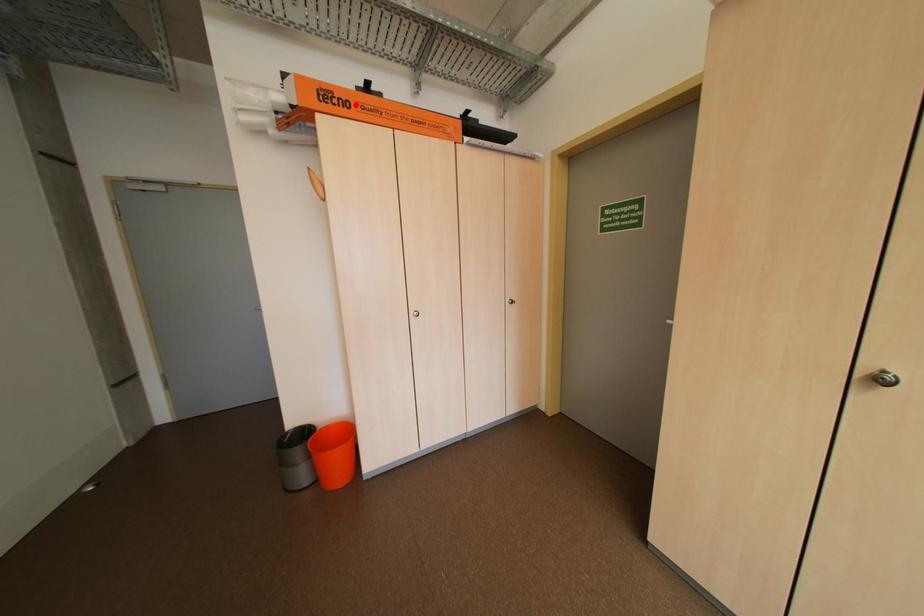
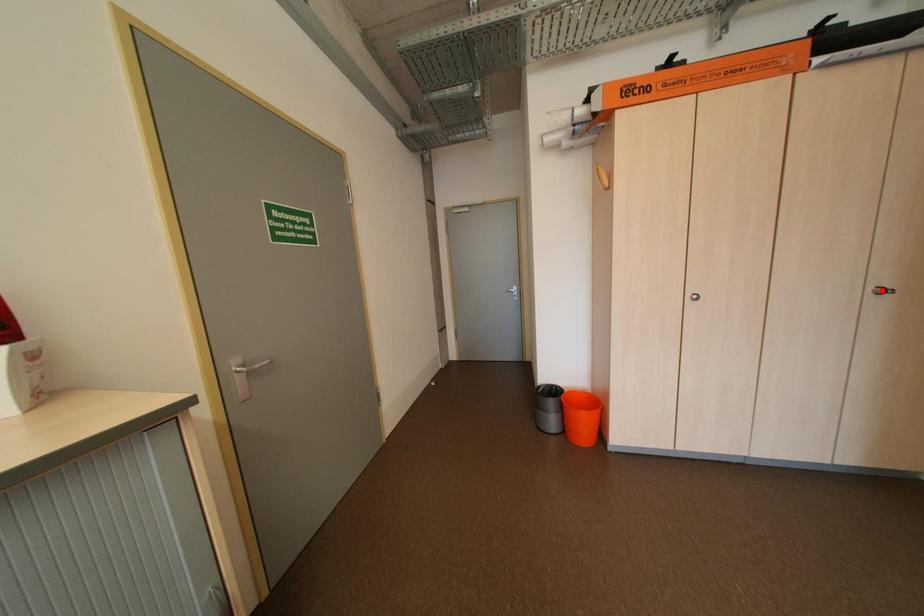
In the scene shown: I am providing you with two images of the same scene from different viewpoints. A red point is marked on the first image and another point is marked on the second image. Is the red point in image1 aligned with the point shown in image2?

No